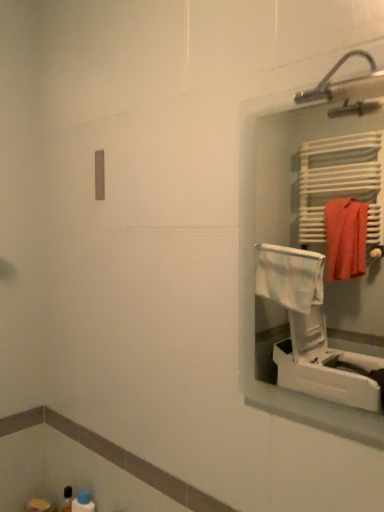
Question: Which is correct: white plastic medicine cabinet at right is inside blue plastic bottle at lower left, or outside of it?

Choices:
 (A) outside
 (B) inside

Answer: (A)

Question: Based on their sizes in the image, would you say white plastic medicine cabinet at right is bigger or smaller than blue plastic bottle at lower left?

Choices:
 (A) big
 (B) small

Answer: (A)

Question: Based on their positions, is white plastic medicine cabinet at right located to the left or right of blue plastic bottle at lower left?

Choices:
 (A) left
 (B) right

Answer: (B)

Question: From the image's perspective, relative to white plastic medicine cabinet at right, is blue plastic bottle at lower left above or below?

Choices:
 (A) below
 (B) above

Answer: (A)

Question: Considering the positions of blue plastic bottle at lower left and white plastic medicine cabinet at right in the image, is blue plastic bottle at lower left bigger or smaller than white plastic medicine cabinet at right?

Choices:
 (A) small
 (B) big

Answer: (A)

Question: Is point (77, 492) closer or farther from the camera than point (327, 381)?

Choices:
 (A) closer
 (B) farther

Answer: (A)

Question: From their relative heights in the image, would you say blue plastic bottle at lower left is taller or shorter than white plastic medicine cabinet at right?

Choices:
 (A) tall
 (B) short

Answer: (B)